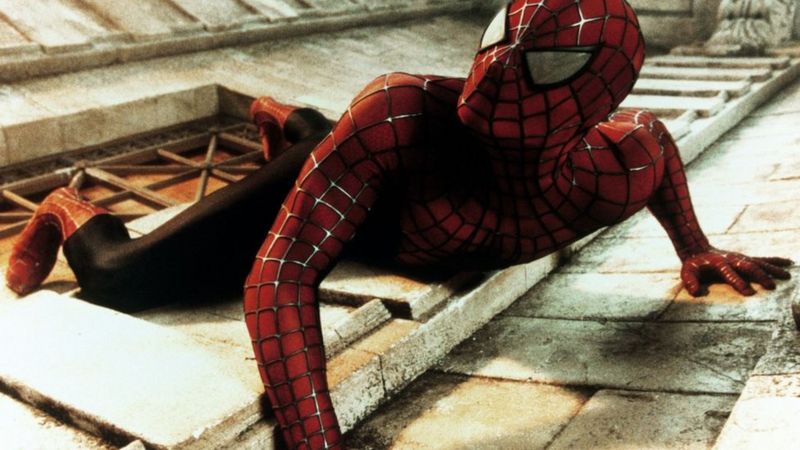
Where is `wall`? wall is located at coordinates (688, 20).